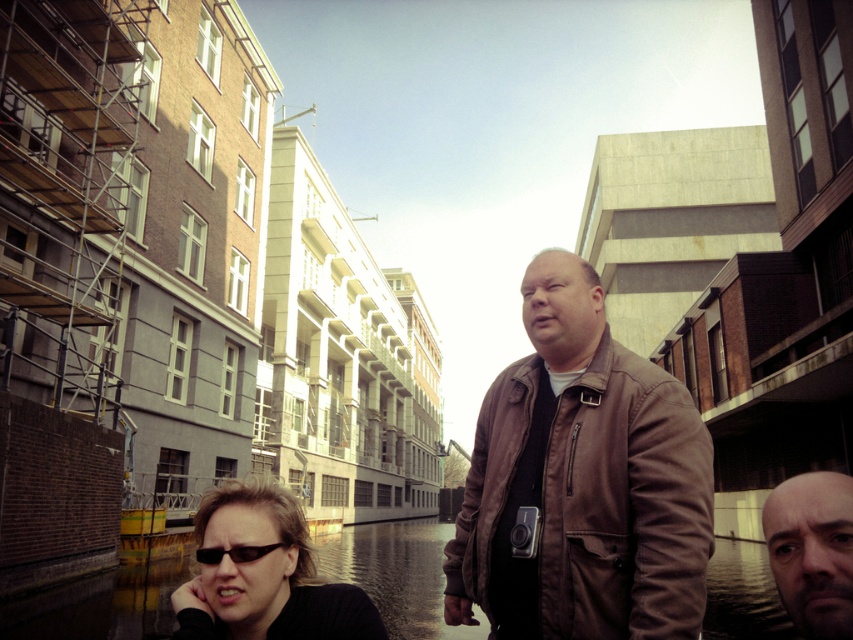
Between point (587, 624) and point (206, 548), which one is positioned in front?

Point (587, 624) is in front.

Is the position of brown leather jacket at center more distant than that of black plastic sunglasses at lower left?

No, brown leather jacket at center is closer to the viewer.

Locate an element on the screen. brown leather jacket at center is located at coordinates (587, 502).

I want to click on brown leather jacket at center, so click(x=587, y=502).

Does brown leather jacket at center appear on the right side of black matte sunglasses at lower left?

Correct, you'll find brown leather jacket at center to the right of black matte sunglasses at lower left.

Is brown leather jacket at center thinner than black matte sunglasses at lower left?

No, brown leather jacket at center is not thinner than black matte sunglasses at lower left.

Does point (686, 461) come closer to viewer compared to point (252, 632)?

No.

Where is `brown leather jacket at center`? brown leather jacket at center is located at coordinates (587, 502).

How far apart are black matte sunglasses at lower left and black plastic sunglasses at lower left?

22.83 inches

Which is behind, point (300, 529) or point (268, 544)?

Positioned behind is point (300, 529).

Image resolution: width=853 pixels, height=640 pixels. What do you see at coordinates (263, 573) in the screenshot?
I see `black matte sunglasses at lower left` at bounding box center [263, 573].

The image size is (853, 640). Find the location of `black matte sunglasses at lower left`. black matte sunglasses at lower left is located at coordinates (263, 573).